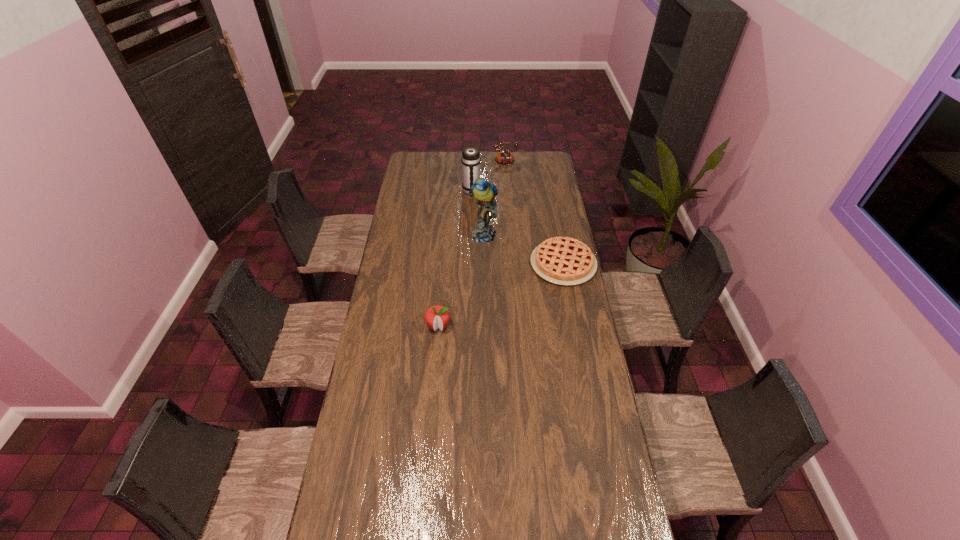
Identify the location of apple. The image size is (960, 540). (437, 316).

The width and height of the screenshot is (960, 540). I want to click on the nearest object, so click(x=437, y=316).

At what (x,y) coordinates should I click in order to perform the action: click on the shortest object. Please return your answer as a coordinate pair (x, y). Looking at the image, I should click on (561, 260).

This screenshot has height=540, width=960. Find the location of `pie`. pie is located at coordinates (561, 260).

I want to click on the fourth nearest object, so click(470, 160).

Locate an element on the screen. the second tallest object is located at coordinates (470, 160).

What are the coordinates of `the tallest object` in the screenshot? It's located at (483, 192).

Locate an element on the screen. Image resolution: width=960 pixels, height=540 pixels. telephone is located at coordinates (504, 157).

Where is `vacant space positioned 0.150m on the side where a bite is taken out of the nearest object`? vacant space positioned 0.150m on the side where a bite is taken out of the nearest object is located at coordinates (435, 367).

Identify the location of vacant region located on the back of the shortest object. (554, 212).